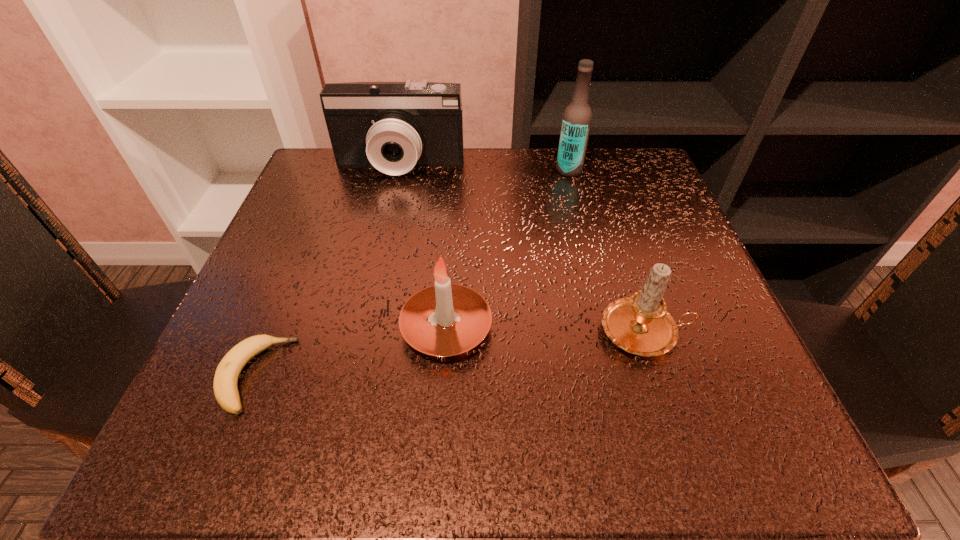
The width and height of the screenshot is (960, 540). I want to click on vacant space that is in between the camcorder and the right candle, so click(523, 249).

At what (x,y) coordinates should I click in order to perform the action: click on free space between the second tallest object and the shortest object. Please return your answer as a coordinate pair (x, y). This screenshot has width=960, height=540. Looking at the image, I should click on (328, 271).

At what (x,y) coordinates should I click in order to perform the action: click on vacant point located between the left candle and the right candle. Please return your answer as a coordinate pair (x, y). This screenshot has height=540, width=960. Looking at the image, I should click on (546, 330).

Where is `vacant area that lies between the second tallest object and the tallest object`? vacant area that lies between the second tallest object and the tallest object is located at coordinates (485, 168).

Locate an element on the screen. The width and height of the screenshot is (960, 540). free point between the right candle and the fourth shortest object is located at coordinates (523, 249).

The image size is (960, 540). I want to click on empty location between the tallest object and the shortest object, so click(x=413, y=273).

You are a GUI agent. You are given a task and a screenshot of the screen. Output one action in this format:
    pyautogui.click(x=<x>, y=<y>)
    Task: Click on the vacant area that lies between the fourth shortest object and the right candle
    The width and height of the screenshot is (960, 540).
    Given the screenshot: What is the action you would take?
    pyautogui.click(x=523, y=249)

At what (x,y) coordinates should I click in order to perform the action: click on blank region between the banana and the second tallest object. Please return your answer as a coordinate pair (x, y). Image resolution: width=960 pixels, height=540 pixels. Looking at the image, I should click on (328, 271).

Identify the location of empty location between the left candle and the beer bottle. The height and width of the screenshot is (540, 960). click(508, 249).

The image size is (960, 540). I want to click on object that stands as the third closest to the beer bottle, so click(443, 320).